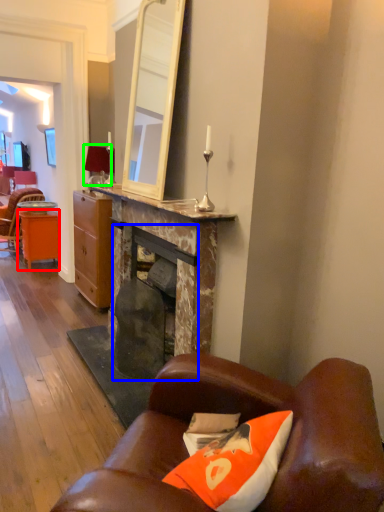
Question: Estimate the real-world distances between objects in this image. Which object is farther from desk (highlighted by a red box), fireplace (highlighted by a blue box) or lamp (highlighted by a green box)?

Choices:
 (A) fireplace
 (B) lamp

Answer: (A)